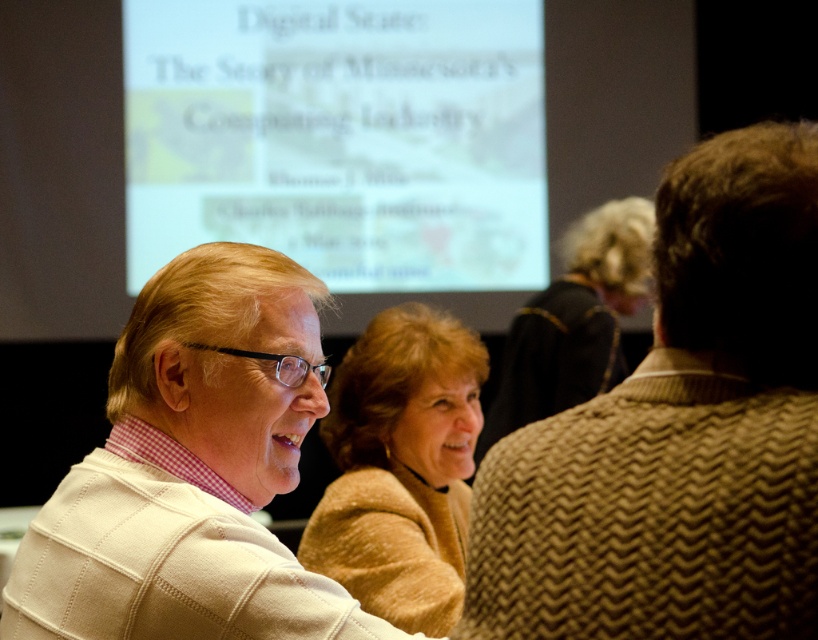
Between light brown sweater at center and brown wool sweater at center, which one has less height?

light brown sweater at center

Is light brown sweater at center thinner than brown wool sweater at center?

Indeed, light brown sweater at center has a lesser width compared to brown wool sweater at center.

What do you see at coordinates (399, 468) in the screenshot? Image resolution: width=818 pixels, height=640 pixels. I see `light brown sweater at center` at bounding box center [399, 468].

You are a GUI agent. You are given a task and a screenshot of the screen. Output one action in this format:
    pyautogui.click(x=<x>, y=<y>)
    Task: Click on the light brown sweater at center
    This screenshot has width=818, height=640.
    Given the screenshot: What is the action you would take?
    pyautogui.click(x=399, y=468)

Is white knitted sweater at center positioned behind brown wool sweater at center?

No, it is in front of brown wool sweater at center.

Does white knitted sweater at center have a lesser height compared to brown wool sweater at center?

Yes.

Where is `white knitted sweater at center`? white knitted sweater at center is located at coordinates (191, 470).

Who is lower down, knitted brown sweater at center or white knitted sweater at center?

Positioned lower is white knitted sweater at center.

Who is more distant from viewer, (664, 541) or (304, 273)?

The point (304, 273) is behind.

Image resolution: width=818 pixels, height=640 pixels. What are the coordinates of `knitted brown sweater at center` in the screenshot? It's located at (679, 433).